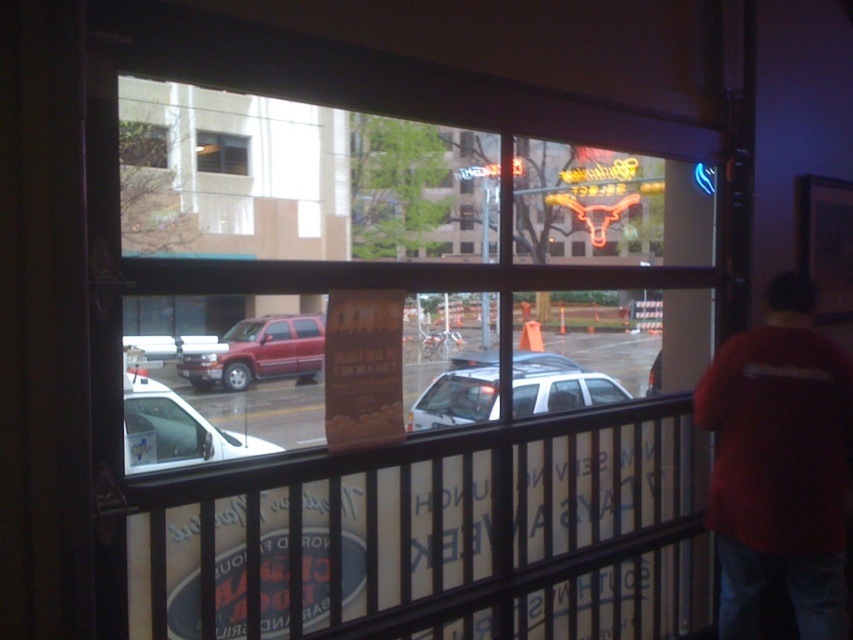
Consider the image. Which of these two, metallic red truck at center or transparent glass window at center, stands shorter?

With less height is transparent glass window at center.

Who is more distant from viewer, [312,365] or [430,186]?

The point [430,186] is more distant.

Image resolution: width=853 pixels, height=640 pixels. Find the location of `metallic red truck at center`. metallic red truck at center is located at coordinates (259, 353).

Is clear glass fence at lower center taller than clear glass window at upper left?

No.

Is clear glass fence at lower center wider than clear glass window at upper left?

Incorrect, clear glass fence at lower center's width does not surpass clear glass window at upper left's.

Is point (450, 596) farther from viewer compared to point (164, 147)?

No, it is in front of (164, 147).

You are a GUI agent. You are given a task and a screenshot of the screen. Output one action in this format:
    pyautogui.click(x=<x>, y=<y>)
    Task: Click on the clear glass fence at lower center
    This screenshot has width=853, height=640.
    Given the screenshot: What is the action you would take?
    pyautogui.click(x=436, y=534)

Who is lower down, red cotton shirt at right or transparent glass window at center?

Positioned lower is red cotton shirt at right.

How distant is red cotton shirt at right from transparent glass window at center?

red cotton shirt at right and transparent glass window at center are 19.93 meters apart from each other.

Image resolution: width=853 pixels, height=640 pixels. Describe the element at coordinates (779, 465) in the screenshot. I see `red cotton shirt at right` at that location.

I want to click on red cotton shirt at right, so click(779, 465).